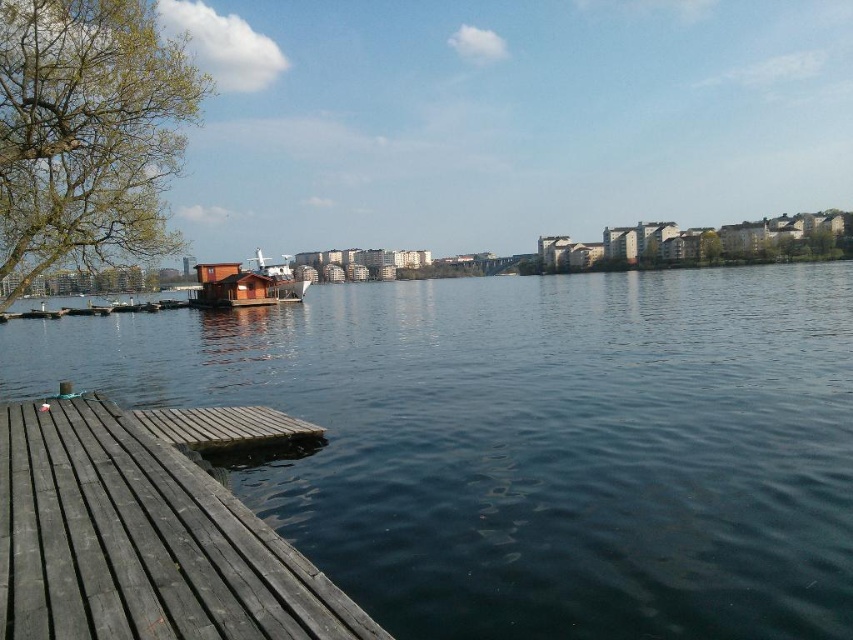
Question: Which of the following is the farthest from the observer?

Choices:
 (A) (57, 493)
 (B) (772, 301)
 (C) (254, 298)
 (D) (300, 433)

Answer: (C)

Question: Can you confirm if dark blue water at center is positioned to the left of dark gray wood dock at lower left?

Choices:
 (A) no
 (B) yes

Answer: (A)

Question: Which point is closer to the camera?

Choices:
 (A) brown wooden dock at lower left
 (B) wooden cabin at center
 (C) dark blue water at center
 (D) dark gray wood dock at lower left

Answer: (D)

Question: Is dark gray wood dock at lower left to the left of wooden cabin at center from the viewer's perspective?

Choices:
 (A) no
 (B) yes

Answer: (A)

Question: Based on their relative distances, which object is nearer to the dark blue water at center?

Choices:
 (A) dark gray wood dock at lower left
 (B) brown wooden dock at lower left

Answer: (A)

Question: Is brown wooden dock at lower left wider than wooden cabin at center?

Choices:
 (A) yes
 (B) no

Answer: (B)